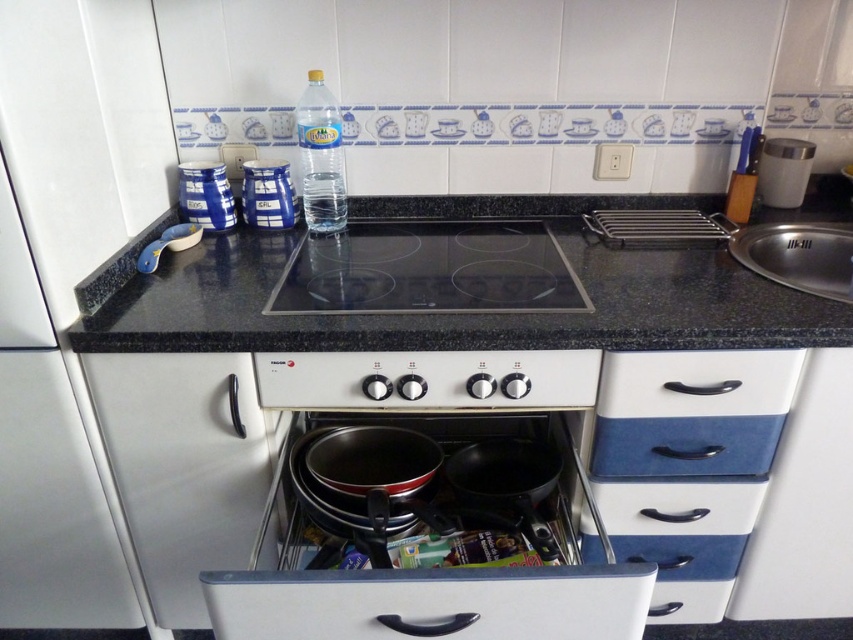
Describe the element at coordinates (426, 502) in the screenshot. I see `white glossy oven at center` at that location.

Who is higher up, white glossy oven at center or blue glossy canister at center?

blue glossy canister at center is above.

Does point (433, 460) come farther from viewer compared to point (286, 204)?

No, (433, 460) is in front of (286, 204).

Locate an element on the screen. The width and height of the screenshot is (853, 640). white glossy oven at center is located at coordinates (426, 502).

Which is behind, point (546, 316) or point (328, 131)?

Point (328, 131)

Can you confirm if granite black countertop at center is wider than clear plastic bottle at center?

Indeed, granite black countertop at center has a greater width compared to clear plastic bottle at center.

Between point (842, 342) and point (339, 161), which one is positioned behind?

The point (339, 161) is behind.

Locate an element on the screen. This screenshot has height=640, width=853. granite black countertop at center is located at coordinates (451, 314).

Can you confirm if granite/black at center is taller than blue glossy canister at center?

Yes.

Is granite/black at center to the right of blue glossy canister at center from the viewer's perspective?

Yes, granite/black at center is to the right of blue glossy canister at center.

In the scene shown: Who is more distant from viewer, [660,300] or [280,164]?

Positioned behind is point [280,164].

At what (x,y) coordinates should I click in order to perform the action: click on granite/black at center. Please return your answer as a coordinate pair (x, y). The height and width of the screenshot is (640, 853). Looking at the image, I should click on (502, 317).